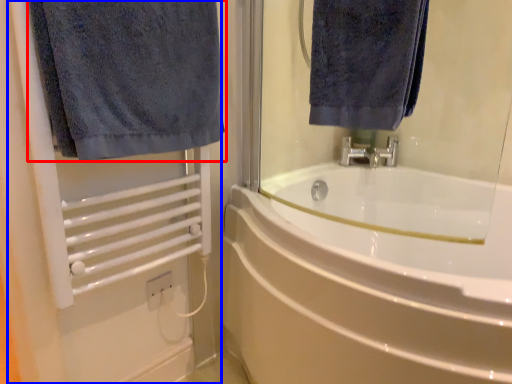
Question: Which point is closer to the camera, towel (highlighted by a red box) or screen door (highlighted by a blue box)?

Choices:
 (A) towel
 (B) screen door

Answer: (A)